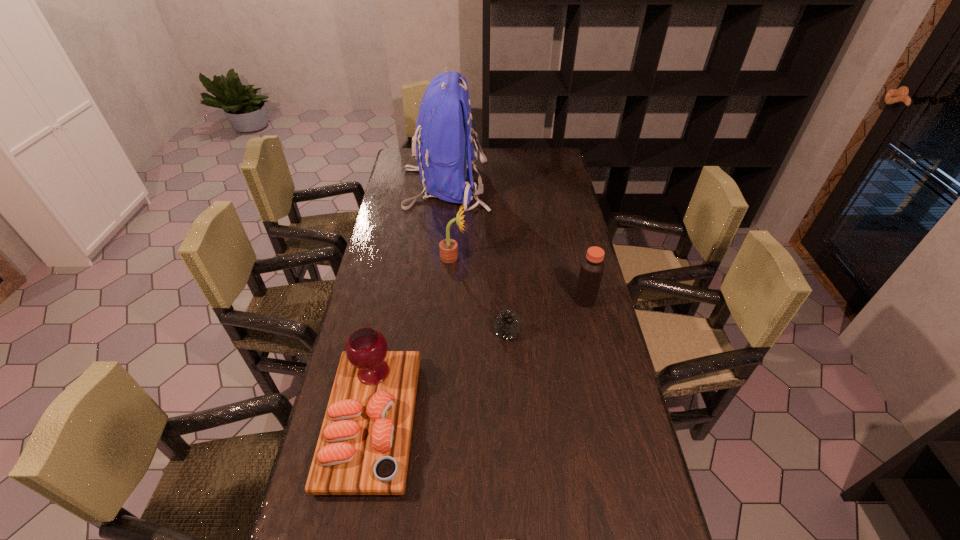
Find the location of a particular element. blank space at the right edge of the desktop is located at coordinates (549, 271).

Where is `free space between the nearest object and the pinecone`? The image size is (960, 540). free space between the nearest object and the pinecone is located at coordinates (439, 377).

I want to click on empty space between the rightmost object and the second farthest object, so coord(519,279).

Where is `empty space that is in between the rightmost object and the farthest object`? The width and height of the screenshot is (960, 540). empty space that is in between the rightmost object and the farthest object is located at coordinates (516, 243).

Locate an element on the screen. The image size is (960, 540). unoccupied area between the nearest object and the fourth nearest object is located at coordinates (413, 339).

Find the location of a particular element. The width and height of the screenshot is (960, 540). unoccupied position between the nearest object and the farthest object is located at coordinates (409, 304).

Locate an element on the screen. free spot between the nearest object and the tallest object is located at coordinates (409, 304).

You are a GUI agent. You are given a task and a screenshot of the screen. Output one action in this format:
    pyautogui.click(x=<x>, y=<y>)
    Task: Click on the second closest object to the farthest object
    This screenshot has width=960, height=540.
    Given the screenshot: What is the action you would take?
    pyautogui.click(x=592, y=267)

Locate an element on the screen. object that is the second closest to the nearest object is located at coordinates (448, 247).

You are a GUI agent. You are given a task and a screenshot of the screen. Output one action in this format:
    pyautogui.click(x=<x>, y=<y>)
    Task: Click on the free space that satisfies the following two spatial constraints: 1. on the back of the tallest object; 2. on the back side of the pinecone
    The image size is (960, 540).
    Given the screenshot: What is the action you would take?
    pyautogui.click(x=431, y=333)